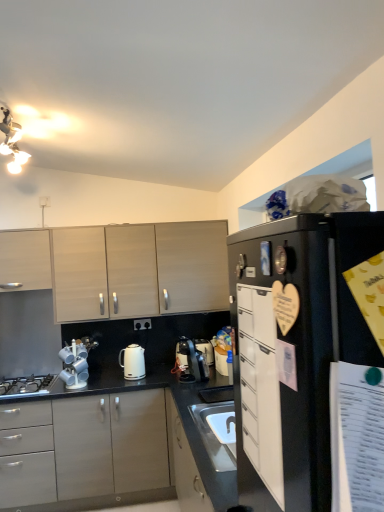
This screenshot has height=512, width=384. Describe the element at coordinates (88, 454) in the screenshot. I see `matte gray cabinets at center, which appears as the 3th cabinetry when viewed from the back` at that location.

Locate an element on the screen. The height and width of the screenshot is (512, 384). black matte refrigerator at upper right is located at coordinates (309, 361).

This screenshot has width=384, height=512. What do you see at coordinates (25, 260) in the screenshot?
I see `matte beige cabinet at upper left, the 2th cabinetry in the back-to-front sequence` at bounding box center [25, 260].

Identify the location of metallic silver cup rack at lower left. The height and width of the screenshot is (512, 384). (76, 362).

At what (x,y) coordinates should I click in order to perform the action: click on white matte cabinet at right, acting as the 4th cabinetry starting from the back. Please return your answer as a coordinate pair (x, y). This screenshot has width=384, height=512. Looking at the image, I should click on (260, 387).

What do you see at coordinates (260, 387) in the screenshot?
I see `white matte cabinet at right, acting as the 4th cabinetry starting from the back` at bounding box center [260, 387].

Where is `matte gray cabinets at center, which appears as the 3th cabinetry when viewed from the back`? This screenshot has width=384, height=512. matte gray cabinets at center, which appears as the 3th cabinetry when viewed from the back is located at coordinates (88, 454).

From the image's perspective, is white matte cabinet at right, arranged as the 1th cabinetry when viewed from the front, above or below satin black coffee machine at center?

Clearly, from the image's perspective, white matte cabinet at right, arranged as the 1th cabinetry when viewed from the front, is above satin black coffee machine at center.

Is white matte cabinet at right, arranged as the 1th cabinetry when viewed from the front, to the left of satin black coffee machine at center from the viewer's perspective?

Incorrect, white matte cabinet at right, arranged as the 1th cabinetry when viewed from the front, is not on the left side of satin black coffee machine at center.

Is white matte cabinet at right, acting as the 4th cabinetry starting from the back, inside the boundaries of satin black coffee machine at center, or outside?

white matte cabinet at right, acting as the 4th cabinetry starting from the back, lies outside satin black coffee machine at center.

Considering the positions of objects metallic silver cup rack at lower left and matte gray cabinets at center, which appears as the 3th cabinetry when viewed from the back, in the image provided, who is in front, metallic silver cup rack at lower left or matte gray cabinets at center, which appears as the 3th cabinetry when viewed from the back,?

matte gray cabinets at center, which appears as the 3th cabinetry when viewed from the back, is closer to the camera.

Is metallic silver cup rack at lower left to the left of matte gray cabinets at center, which appears as the 3th cabinetry when viewed from the back, from the viewer's perspective?

Indeed, metallic silver cup rack at lower left is positioned on the left side of matte gray cabinets at center, which appears as the 3th cabinetry when viewed from the back.

There is a matte gray cabinets at center, the second cabinetry in the front-to-back sequence. At what (x,y) coordinates should I click in order to perform the action: click on appliance above it (from a real-world perspective). Please return your answer as a coordinate pair (x, y). This screenshot has width=384, height=512. Looking at the image, I should click on (76, 362).

Considering the sizes of objects metallic silver cup rack at lower left and black matte refrigerator at upper right in the image provided, who is bigger, metallic silver cup rack at lower left or black matte refrigerator at upper right?

black matte refrigerator at upper right.

Considering the relative sizes of metallic silver cup rack at lower left and black matte refrigerator at upper right in the image provided, is metallic silver cup rack at lower left wider than black matte refrigerator at upper right?

In fact, metallic silver cup rack at lower left might be narrower than black matte refrigerator at upper right.

Is metallic silver cup rack at lower left further to camera compared to black matte refrigerator at upper right?

Yes, metallic silver cup rack at lower left is further from the camera.

From the image's perspective, is metallic silver cup rack at lower left located above black matte refrigerator at upper right?

Incorrect, from the image's perspective, metallic silver cup rack at lower left is lower than black matte refrigerator at upper right.

This screenshot has height=512, width=384. In order to click on kitchen appliance on the left of white matte cabinet at right, acting as the 4th cabinetry starting from the back in this screenshot , I will do `click(133, 362)`.

Is white matte cabinet at right, arranged as the 1th cabinetry when viewed from the front, outside of white glossy kettle at center?

white matte cabinet at right, arranged as the 1th cabinetry when viewed from the front, lies outside white glossy kettle at center's area.

Which is less distant, (x=271, y=424) or (x=140, y=358)?

Point (x=271, y=424).

From a real-world perspective, is white matte cabinet at right, acting as the 4th cabinetry starting from the back, positioned under black matte gas stove at lower left based on gravity?

No, from a real-world perspective, white matte cabinet at right, acting as the 4th cabinetry starting from the back, is not beneath black matte gas stove at lower left.

Is white matte cabinet at right, arranged as the 1th cabinetry when viewed from the front, turned away from black matte gas stove at lower left?

No, white matte cabinet at right, arranged as the 1th cabinetry when viewed from the front, is not facing away from black matte gas stove at lower left.

Which object is closer to the camera, white matte cabinet at right, acting as the 4th cabinetry starting from the back, or black matte gas stove at lower left?

white matte cabinet at right, acting as the 4th cabinetry starting from the back, is in front.

From the image's perspective, is metallic silver cup rack at lower left above light wood/veneer cabinets at upper left, which ranks as the 4th cabinetry in front-to-back order?

No.

From a real-world perspective, which is physically above, metallic silver cup rack at lower left or light wood/veneer cabinets at upper left, which ranks as the 4th cabinetry in front-to-back order?

From a 3D spatial view, light wood/veneer cabinets at upper left, which ranks as the 4th cabinetry in front-to-back order, is above.

Considering the positions of objects metallic silver cup rack at lower left and light wood/veneer cabinets at upper left, the 1th cabinetry in the back-to-front sequence, in the image provided, who is behind, metallic silver cup rack at lower left or light wood/veneer cabinets at upper left, the 1th cabinetry in the back-to-front sequence,?

light wood/veneer cabinets at upper left, the 1th cabinetry in the back-to-front sequence, is further from the camera.

Is metallic silver cup rack at lower left looking in the opposite direction of light wood/veneer cabinets at upper left, which ranks as the 4th cabinetry in front-to-back order?

That's not correct — metallic silver cup rack at lower left is not looking away from light wood/veneer cabinets at upper left, which ranks as the 4th cabinetry in front-to-back order.

From a real-world perspective, is matte gray cabinets at center, which appears as the 3th cabinetry when viewed from the back, physically above satin black coffee machine at center?

No.

Considering the relative sizes of matte gray cabinets at center, which appears as the 3th cabinetry when viewed from the back, and satin black coffee machine at center in the image provided, is matte gray cabinets at center, which appears as the 3th cabinetry when viewed from the back, thinner than satin black coffee machine at center?

Incorrect, the width of matte gray cabinets at center, which appears as the 3th cabinetry when viewed from the back, is not less than that of satin black coffee machine at center.

Which of these two, matte gray cabinets at center, the second cabinetry in the front-to-back sequence, or satin black coffee machine at center, stands shorter?

satin black coffee machine at center.

Does matte gray cabinets at center, the second cabinetry in the front-to-back sequence, come in front of satin black coffee machine at center?

Yes, the depth of matte gray cabinets at center, the second cabinetry in the front-to-back sequence, is less than that of satin black coffee machine at center.

Find the location of a particular element. This screenshot has width=384, height=512. cabinetry that is the 1st object above the satin black coffee machine at center (from a real-world perspective) is located at coordinates (260, 387).

At what (x,y) coordinates should I click in order to perform the action: click on cabinetry below the metallic silver cup rack at lower left (from the image's perspective). Please return your answer as a coordinate pair (x, y). The height and width of the screenshot is (512, 384). Looking at the image, I should click on (88, 454).

Looking at the image, which one is located further to white glossy kettle at center, black matte gas stove at lower left or matte gray cabinets at center, the second cabinetry in the front-to-back sequence?

black matte gas stove at lower left.

Based on the photo, considering their positions, is white matte cabinet at right, acting as the 4th cabinetry starting from the back, positioned closer to black matte refrigerator at upper right than white glossy kettle at center?

white matte cabinet at right, acting as the 4th cabinetry starting from the back, is positioned closer to the anchor black matte refrigerator at upper right.

Based on their spatial positions, is light wood/veneer cabinets at upper left, which ranks as the 4th cabinetry in front-to-back order, or metallic silver cup rack at lower left closer to white glossy kettle at center?

The object closer to white glossy kettle at center is metallic silver cup rack at lower left.

When comparing their distances from metallic silver cup rack at lower left, does matte beige cabinet at upper left, which appears as the 3th cabinetry when viewed from the front, or black matte refrigerator at upper right seem closer?

Among the two, matte beige cabinet at upper left, which appears as the 3th cabinetry when viewed from the front, is located nearer to metallic silver cup rack at lower left.

Based on their spatial positions, is white glossy kettle at center or matte gray cabinets at center, which appears as the 3th cabinetry when viewed from the back, closer to matte beige cabinet at upper left, which appears as the 3th cabinetry when viewed from the front?

white glossy kettle at center is closer to matte beige cabinet at upper left, which appears as the 3th cabinetry when viewed from the front.

When comparing their distances from satin black coffee machine at center, does white matte cabinet at right, arranged as the 1th cabinetry when viewed from the front, or matte gray cabinets at center, the second cabinetry in the front-to-back sequence, seem closer?

matte gray cabinets at center, the second cabinetry in the front-to-back sequence.

Considering their positions, is satin black coffee machine at center positioned further to black matte gas stove at lower left than white glossy kettle at center?

satin black coffee machine at center.

Estimate the real-world distances between objects in this image. Which object is further from white matte cabinet at right, acting as the 4th cabinetry starting from the back, matte beige cabinet at upper left, the 2th cabinetry in the back-to-front sequence, or white glossy kettle at center?

matte beige cabinet at upper left, the 2th cabinetry in the back-to-front sequence.

Image resolution: width=384 pixels, height=512 pixels. What are the coordinates of `kitchen appliance between metallic silver cup rack at lower left and satin black coffee machine at center in the horizontal direction` in the screenshot? It's located at (133, 362).

In order to click on coffee machine located between white matte cabinet at right, acting as the 4th cabinetry starting from the back, and light wood/veneer cabinets at upper left, which ranks as the 4th cabinetry in front-to-back order, in the depth direction in this screenshot , I will do `click(191, 361)`.

Identify the location of kitchen appliance between satin black coffee machine at center and matte gray cabinets at center, which appears as the 3th cabinetry when viewed from the back, in the vertical direction. The height and width of the screenshot is (512, 384). (133, 362).

You are a GUI agent. You are given a task and a screenshot of the screen. Output one action in this format:
    pyautogui.click(x=<x>, y=<y>)
    Task: Click on the appliance between black matte refrigerator at upper right and matte beige cabinet at upper left, the 2th cabinetry in the back-to-front sequence, from front to back
    This screenshot has height=512, width=384.
    Given the screenshot: What is the action you would take?
    pyautogui.click(x=76, y=362)